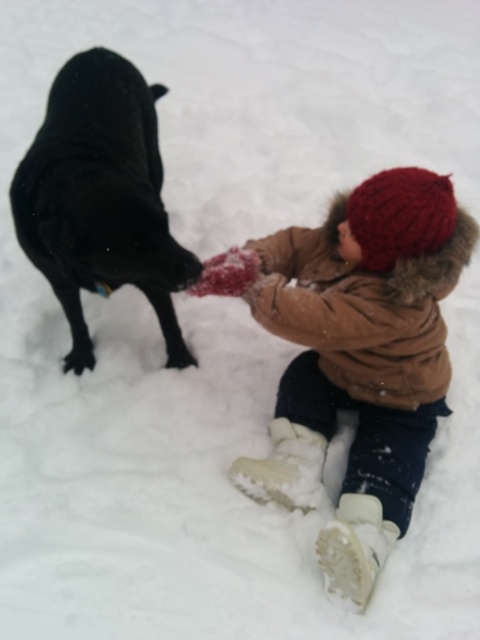
In the scene shown: You are a photographer trying to capture a closeup of the knitted woolen hat at upper center and the shiny black dog at upper left. Which object should you zoom in on first to ensure both are in focus?

The knitted woolen hat at upper center is smaller than the shiny black dog at upper left, so you should zoom in on the shiny black dog at upper left first to ensure both are in focus.

From the picture: You are standing in the snowy scene and want to place a small gift box exactly at the point marked as point (x=262, y=296). If you can only throw the box up to 2 meters, will you be able to reach that point?

The point (x=262, y=296) is 2.07 meters away from the viewer. Since the throwing distance limit is 2 meters, you cannot reach that point with a throw.